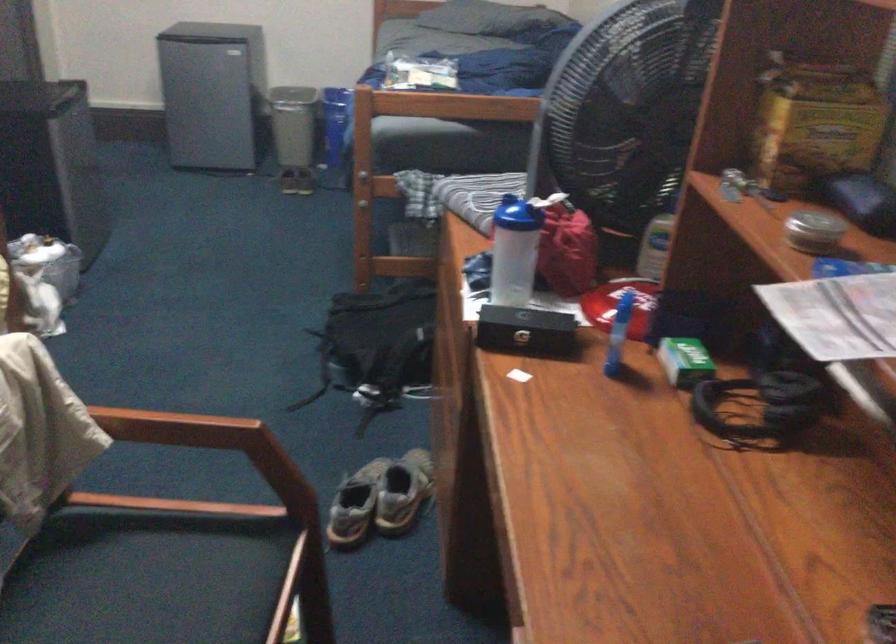
Which object does [814,231] point to?

It corresponds to the round metal tin in the image.